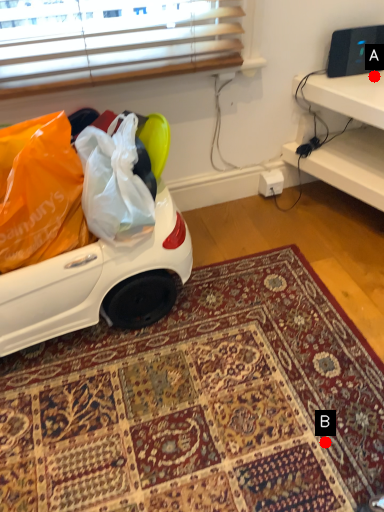
Question: Two points are circled on the image, labeled by A and B beside each circle. Which point is farther from the camera taking this photo?

Choices:
 (A) A is further
 (B) B is further

Answer: (A)